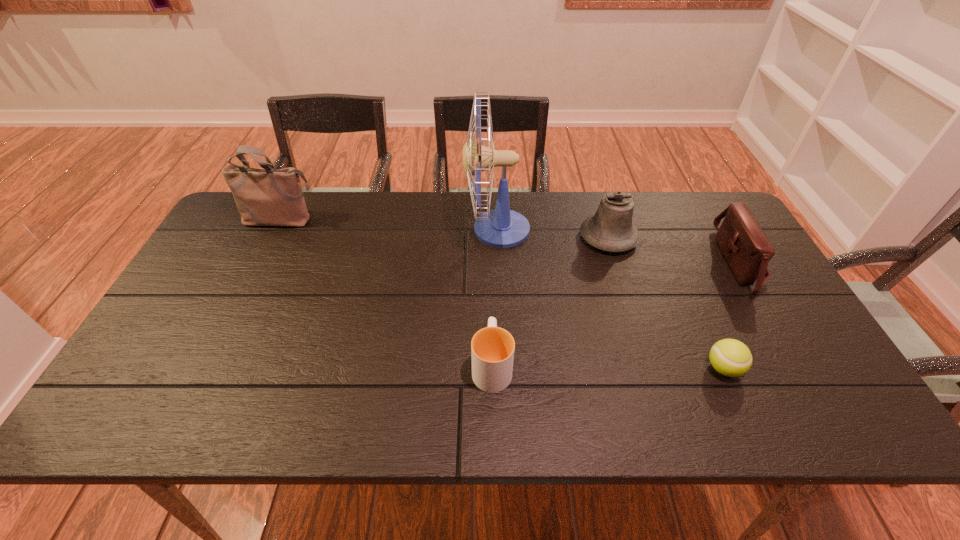
Find the location of a particular element. This screenshot has height=540, width=960. free space at the left edge of the desktop is located at coordinates (180, 324).

At what (x,y) coordinates should I click in order to perform the action: click on blank region between the tallest object and the shortest object. Please return your answer as a coordinate pair (x, y). Looking at the image, I should click on (611, 299).

This screenshot has height=540, width=960. What are the coordinates of `vacant space in between the tennis ball and the fourth object from left to right` in the screenshot? It's located at (665, 303).

At what (x,y) coordinates should I click in order to perform the action: click on free spot between the bell and the fan. Please return your answer as a coordinate pair (x, y). Looking at the image, I should click on (553, 233).

Where is `free space between the fifth tallest object and the rightmost object`? free space between the fifth tallest object and the rightmost object is located at coordinates (615, 314).

Locate an element on the screen. vacant point located between the tennis ball and the fan is located at coordinates (611, 299).

At what (x,y) coordinates should I click in order to perform the action: click on free space between the second shortest object and the tallest object. Please return your answer as a coordinate pair (x, y). The width and height of the screenshot is (960, 540). Looking at the image, I should click on (494, 297).

Where is `empty location between the second object from right to left and the fifth shortest object`? empty location between the second object from right to left and the fifth shortest object is located at coordinates (502, 294).

This screenshot has height=540, width=960. In order to click on free spot between the third shortest object and the second object from right to left in this screenshot , I will do `click(732, 315)`.

Point out which object is positioned as the third nearest to the tallest object. Please provide its 2D coordinates. Your answer should be formatted as a tuple, i.e. [(x, y)], where the tuple contains the x and y coordinates of a point satisfying the conditions above.

[(264, 197)]